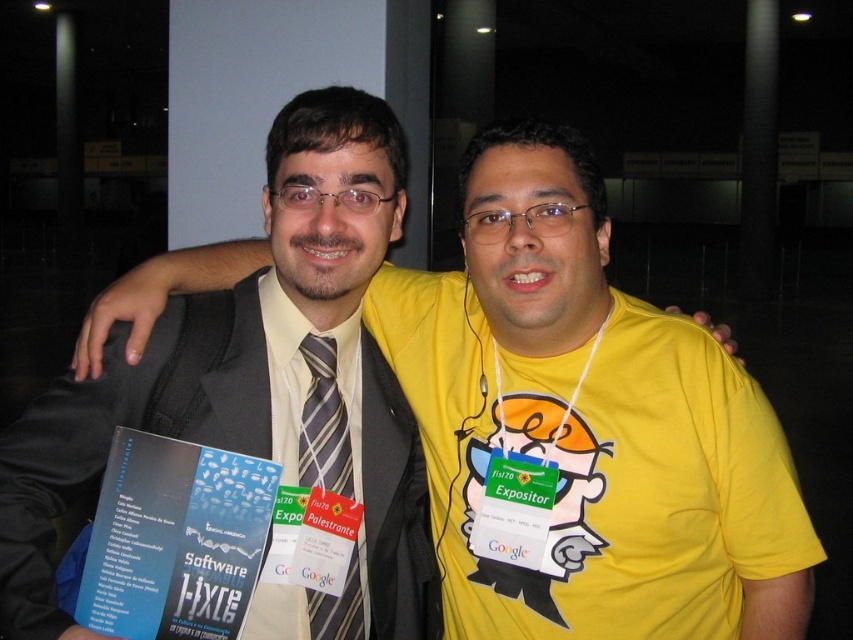
You are standing at the entrance of the event venue and want to find the person wearing the yellow matte shirt at center. According to the image provided, what are the coordinates of this person?

The yellow matte shirt at center is located at point (589, 422).

You are a photographer adjusting your camera settings to capture a clear shot of two points in the image. The first point is labeled as point (447, 298) and the second is point (311, 371). Which point should you focus on first to ensure both are in focus?

You should focus on point (447, 298) first because it is closer to the viewer than point (311, 371), ensuring both points are within the depth of field.